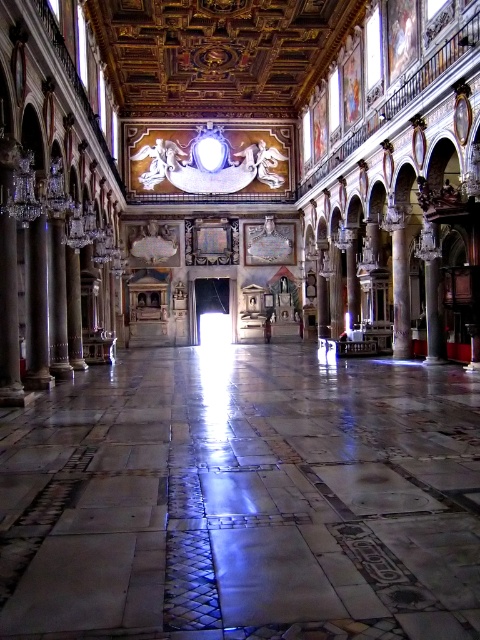
Question: Which point is closer to the camera?

Choices:
 (A) white marble corridor at center
 (B) white marble pillar at center

Answer: (A)

Question: Considering the real-world distances, which object is closest to the marble column at center?

Choices:
 (A) polished marble column at left
 (B) white marble corridor at center

Answer: (B)

Question: Can you confirm if polished marble column at left is bigger than white marble pillar at center?

Choices:
 (A) yes
 (B) no

Answer: (B)

Question: Which point appears closest to the camera in this image?

Choices:
 (A) (345, 250)
 (B) (404, 339)
 (C) (27, 275)
 (D) (406, 436)

Answer: (D)

Question: Is white marble pillar at left wider than polished marble column at left?

Choices:
 (A) no
 (B) yes

Answer: (B)

Question: Does white marble corridor at center lie in front of white marble pillar at left?

Choices:
 (A) yes
 (B) no

Answer: (A)